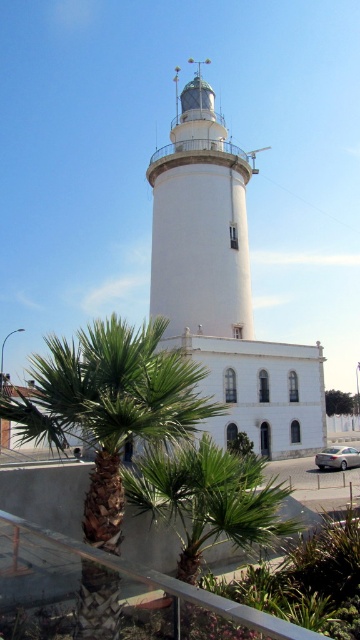
Question: Estimate the real-world distances between objects in this image. Which object is closer to the green leafy palm at lower center?

Choices:
 (A) green leafy tree at lower center
 (B) white smooth lighthouse at center

Answer: (B)

Question: Which is farther from the green leafy tree at lower center?

Choices:
 (A) green leafy palm at lower center
 (B) white smooth lighthouse at center

Answer: (A)

Question: Is green leafy palm at lower center bigger than green leafy tree at lower center?

Choices:
 (A) yes
 (B) no

Answer: (A)

Question: Is white smooth lighthouse at center above green leafy tree at lower center?

Choices:
 (A) no
 (B) yes

Answer: (B)

Question: Which of the following is the farthest from the observer?

Choices:
 (A) white smooth lighthouse at center
 (B) green leafy palm at lower center

Answer: (A)

Question: From the image, what is the correct spatial relationship of green leafy palm at lower center in relation to white smooth lighthouse at center?

Choices:
 (A) right
 (B) left

Answer: (B)